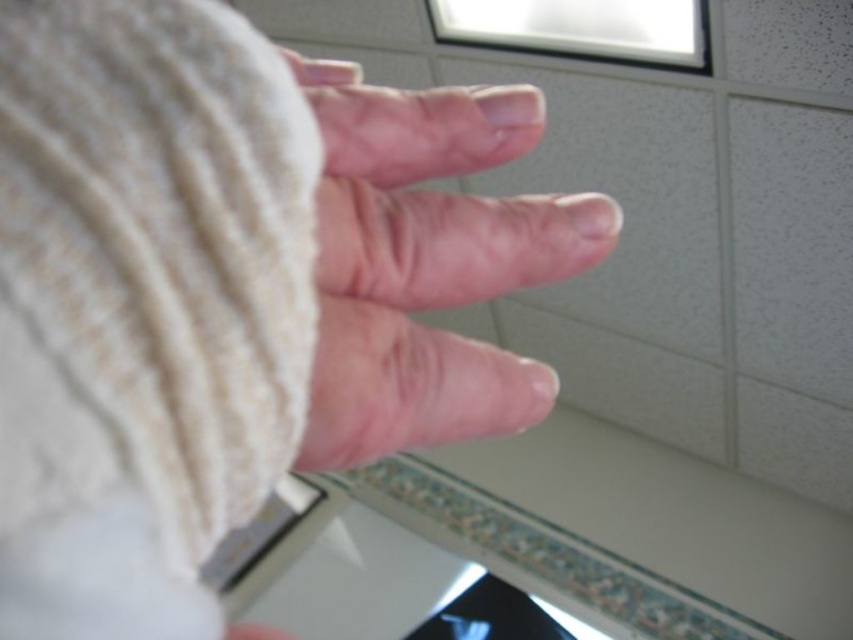
Can you confirm if white knitted hand at center is positioned to the right of pink flesh at center?

Incorrect, white knitted hand at center is not on the right side of pink flesh at center.

Who is positioned more to the right, white knitted hand at center or pink flesh at center?

From the viewer's perspective, pink flesh at center appears more on the right side.

Between point (19, 195) and point (300, 451), which one is positioned behind?

Positioned behind is point (300, 451).

Find the location of a particular element. white knitted hand at center is located at coordinates (231, 292).